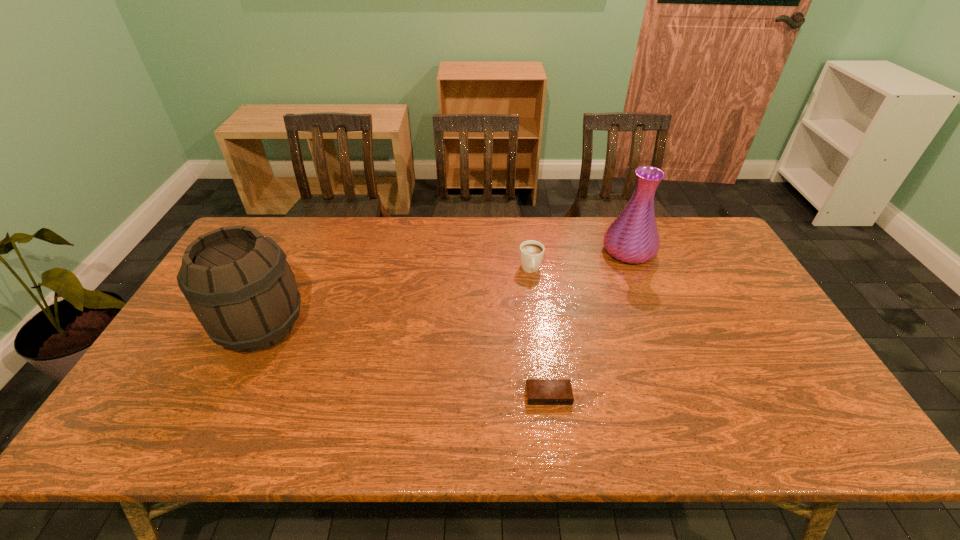
Where is `free space between the wine bucket and the nearest object`? free space between the wine bucket and the nearest object is located at coordinates (405, 361).

Locate an element on the screen. empty space between the third tallest object and the leftmost object is located at coordinates (396, 298).

I want to click on vacant point located between the leftmost object and the vase, so click(445, 289).

Identify the location of free area in between the rightmost object and the leftmost object. (445, 289).

Locate an element on the screen. empty space between the shortest object and the vase is located at coordinates (588, 323).

Find the location of a particular element. The width and height of the screenshot is (960, 540). empty space between the shortest object and the cappuccino is located at coordinates (x=540, y=332).

I want to click on vacant region between the second shortest object and the third farthest object, so click(396, 298).

Where is `free space between the third tallest object and the vase`? The width and height of the screenshot is (960, 540). free space between the third tallest object and the vase is located at coordinates (580, 260).

Locate an element on the screen. The height and width of the screenshot is (540, 960). free spot between the rightmost object and the shortest object is located at coordinates [x=588, y=323].

Identify which object is located as the nearest to the shortest object. Please provide its 2D coordinates. Your answer should be formatted as a tuple, i.e. [(x, y)], where the tuple contains the x and y coordinates of a point satisfying the conditions above.

[(531, 252)]